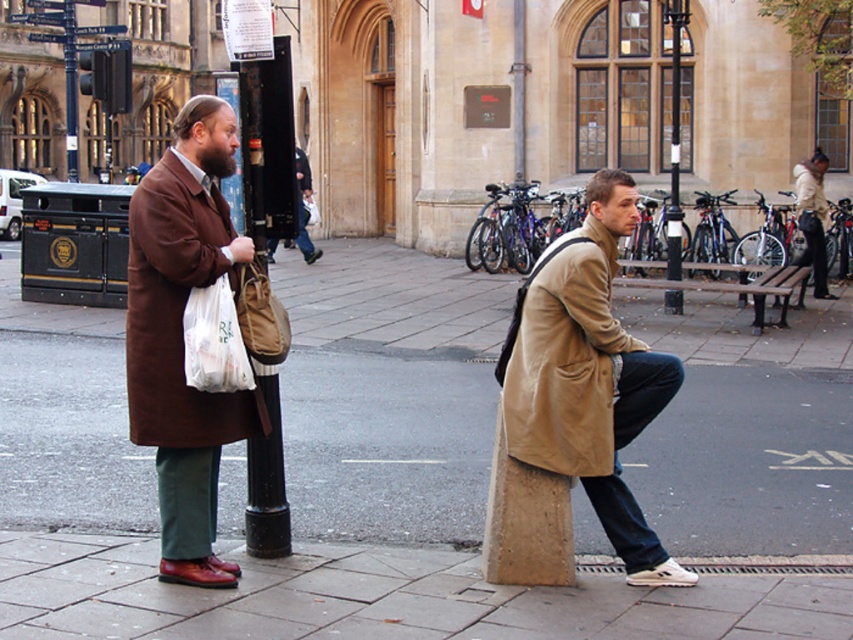
Question: Which of the following is the closest to the observer?

Choices:
 (A) (320, 544)
 (B) (146, 310)
 (C) (672, 209)

Answer: (B)

Question: Among these points, which one is farthest from the camera?

Choices:
 (A) (608, 369)
 (B) (83, 614)
 (C) (643, 387)

Answer: (C)

Question: Does tan suede coat at lower right have a lesser width compared to black metal pole at upper center?

Choices:
 (A) no
 (B) yes

Answer: (A)

Question: Can you confirm if beige woolen trench coat at lower center is positioned below black metal pole at upper center?

Choices:
 (A) yes
 (B) no

Answer: (A)

Question: Which point is closer to the camera taking this photo?

Choices:
 (A) (601, 384)
 (B) (674, 268)
 (C) (224, 376)
 (D) (805, 637)

Answer: (D)

Question: Can you confirm if translucent plastic bag at left is positioned above black metal pole at upper center?

Choices:
 (A) yes
 (B) no

Answer: (B)